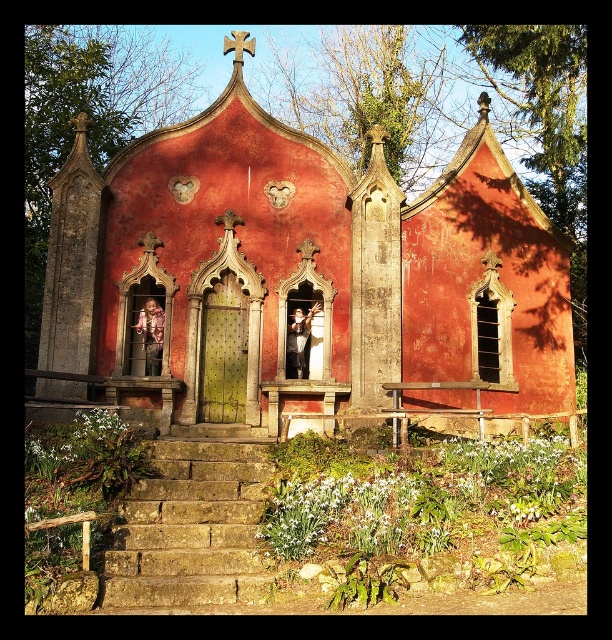
You are standing in front of the chapel and notice two points marked on the chapel wall. The first point is at coordinates point (288, 316) and the second is at point (155, 369). From your perspective, which point is closer to you?

Point (155, 369) is closer to you because it is in front of point (288, 316).